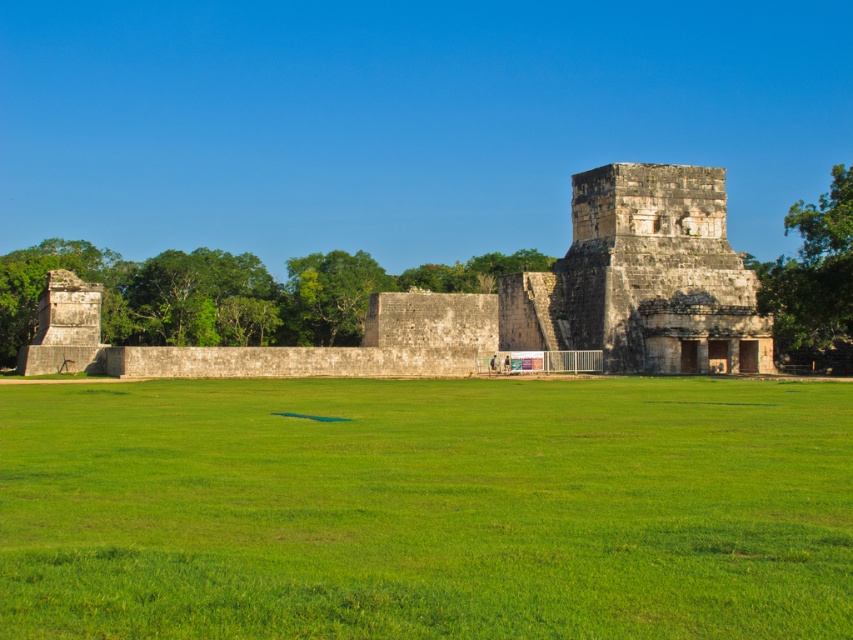
Is point (219, 394) positioned behind point (726, 310)?

No.

Between point (215, 388) and point (28, 360), which one is positioned behind?

The point (28, 360) is behind.

Who is more distant from viewer, (296, 602) or (392, 300)?

The point (392, 300) is more distant.

At what (x,y) coordinates should I click in order to perform the action: click on green grass at center. Please return your answer as a coordinate pair (x, y). Looking at the image, I should click on (426, 508).